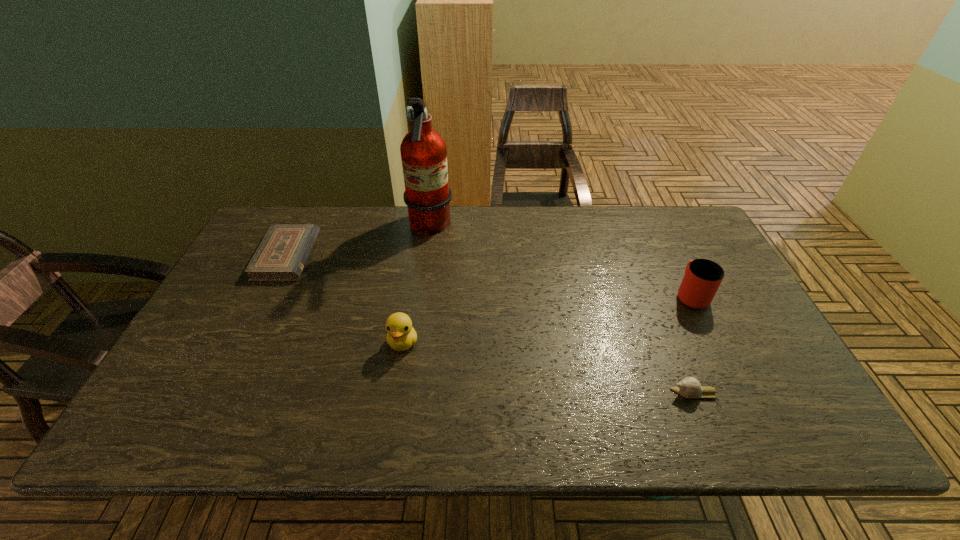
I want to click on the tallest object, so click(427, 195).

This screenshot has width=960, height=540. What are the coordinates of `cup` in the screenshot? It's located at (702, 278).

Locate an element on the screen. duck is located at coordinates (401, 335).

I want to click on the fourth tallest object, so click(689, 387).

The height and width of the screenshot is (540, 960). Find the location of `the nearest object`. the nearest object is located at coordinates (689, 387).

At what (x,y) coordinates should I click in order to perform the action: click on the leftmost object. Please return your answer as a coordinate pair (x, y). The width and height of the screenshot is (960, 540). Looking at the image, I should click on (281, 256).

Identify the location of the shortest object. (281, 256).

You are a GUI agent. You are given a task and a screenshot of the screen. Output one action in this format:
    pyautogui.click(x=<x>, y=<y>)
    Task: Click on the vacant space located on the nozzle and handle of the fire extinguisher
    The height and width of the screenshot is (540, 960).
    Given the screenshot: What is the action you would take?
    pos(504,228)

Locate an element on the screen. The image size is (960, 540). vacant area situated on the handle side of the rightmost object is located at coordinates (665, 242).

Find the location of a particular element. free space located 0.370m on the handle side of the rightmost object is located at coordinates (648, 207).